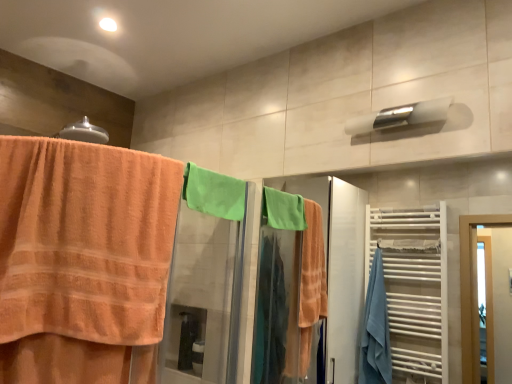
Question: Is orange terry cloth towel at left bigger than green towel at upper right?

Choices:
 (A) yes
 (B) no

Answer: (A)

Question: Can you confirm if orange terry cloth towel at left is thinner than green towel at upper right?

Choices:
 (A) no
 (B) yes

Answer: (A)

Question: Are orange terry cloth towel at left and green towel at upper right far apart?

Choices:
 (A) no
 (B) yes

Answer: (B)

Question: Is orange terry cloth towel at left taller than green towel at upper right?

Choices:
 (A) yes
 (B) no

Answer: (B)

Question: Would you say orange terry cloth towel at left is outside green towel at upper right?

Choices:
 (A) no
 (B) yes

Answer: (B)

Question: Is orange terry cloth towel at left at the left side of green towel at upper right?

Choices:
 (A) no
 (B) yes

Answer: (B)

Question: Is green cotton towel at center completely or partially outside of orange terry cloth towel at left?

Choices:
 (A) no
 (B) yes

Answer: (B)

Question: Considering the relative positions of green cotton towel at center and orange terry cloth towel at left in the image provided, is green cotton towel at center to the left of orange terry cloth towel at left from the viewer's perspective?

Choices:
 (A) yes
 (B) no

Answer: (B)

Question: Does green cotton towel at center lie behind orange terry cloth towel at left?

Choices:
 (A) yes
 (B) no

Answer: (A)

Question: Can you confirm if green cotton towel at center is wider than orange terry cloth towel at left?

Choices:
 (A) yes
 (B) no

Answer: (B)

Question: Does green cotton towel at center have a lesser width compared to orange terry cloth towel at left?

Choices:
 (A) yes
 (B) no

Answer: (A)

Question: From a real-world perspective, is green cotton towel at center located higher than orange terry cloth towel at left?

Choices:
 (A) yes
 (B) no

Answer: (A)

Question: From a real-world perspective, is white glossy towel bar at upper center, acting as the second towel bar starting from the right, on orange terry cloth towel at left?

Choices:
 (A) yes
 (B) no

Answer: (A)